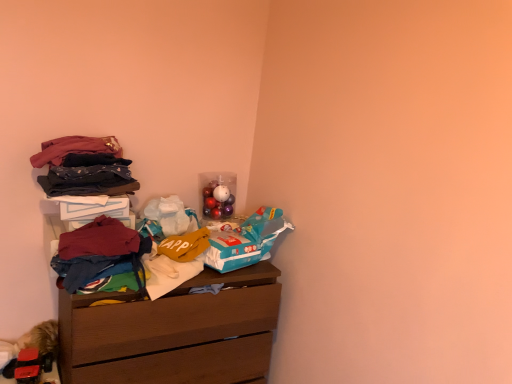
Question: From the image's perspective, is wooden chest of drawers at upper left under maroon fabric shirt at left, which is counted as the second clothing, starting from the bottom?

Choices:
 (A) no
 (B) yes

Answer: (B)

Question: Can you confirm if wooden chest of drawers at upper left is smaller than maroon fabric shirt at left, which is the 3th clothing in top-to-bottom order?

Choices:
 (A) yes
 (B) no

Answer: (B)

Question: From the image's perspective, would you say wooden chest of drawers at upper left is positioned over maroon fabric shirt at left, which is counted as the second clothing, starting from the bottom?

Choices:
 (A) yes
 (B) no

Answer: (B)

Question: From a real-world perspective, does wooden chest of drawers at upper left stand above maroon fabric shirt at left, which is the 3th clothing in top-to-bottom order?

Choices:
 (A) no
 (B) yes

Answer: (A)

Question: Is wooden chest of drawers at upper left behind maroon fabric shirt at left, which is the 3th clothing in top-to-bottom order?

Choices:
 (A) yes
 (B) no

Answer: (A)

Question: Is dark blue cotton pants at left, marked as the third clothing in a bottom-to-top arrangement, spatially inside wooden chest of drawers at upper left, or outside of it?

Choices:
 (A) outside
 (B) inside

Answer: (A)

Question: From a real-world perspective, is dark blue cotton pants at left, marked as the third clothing in a bottom-to-top arrangement, physically located above or below wooden chest of drawers at upper left?

Choices:
 (A) below
 (B) above

Answer: (B)

Question: Is dark blue cotton pants at left, marked as the 2th clothing in a top-to-bottom arrangement, in front of or behind wooden chest of drawers at upper left in the image?

Choices:
 (A) behind
 (B) front

Answer: (A)

Question: From the image's perspective, relative to wooden chest of drawers at upper left, is dark blue cotton pants at left, marked as the third clothing in a bottom-to-top arrangement, above or below?

Choices:
 (A) below
 (B) above

Answer: (B)

Question: Is maroon fabric shirt at left, which is the 3th clothing in top-to-bottom order, in front of or behind wooden chest of drawers at upper left in the image?

Choices:
 (A) behind
 (B) front

Answer: (B)

Question: Is maroon fabric shirt at left, which is counted as the second clothing, starting from the bottom, bigger or smaller than wooden chest of drawers at upper left?

Choices:
 (A) big
 (B) small

Answer: (B)

Question: In terms of width, does maroon fabric shirt at left, which is the 3th clothing in top-to-bottom order, look wider or thinner when compared to wooden chest of drawers at upper left?

Choices:
 (A) wide
 (B) thin

Answer: (B)

Question: From the image's perspective, is maroon fabric shirt at left, which is the 3th clothing in top-to-bottom order, positioned above or below wooden chest of drawers at upper left?

Choices:
 (A) above
 (B) below

Answer: (A)

Question: In terms of width, does wooden chest of drawers at upper left look wider or thinner when compared to dark blue cotton pants at left, marked as the third clothing in a bottom-to-top arrangement?

Choices:
 (A) thin
 (B) wide

Answer: (B)

Question: Based on their sizes in the image, would you say wooden chest of drawers at upper left is bigger or smaller than dark blue cotton pants at left, marked as the third clothing in a bottom-to-top arrangement?

Choices:
 (A) big
 (B) small

Answer: (A)